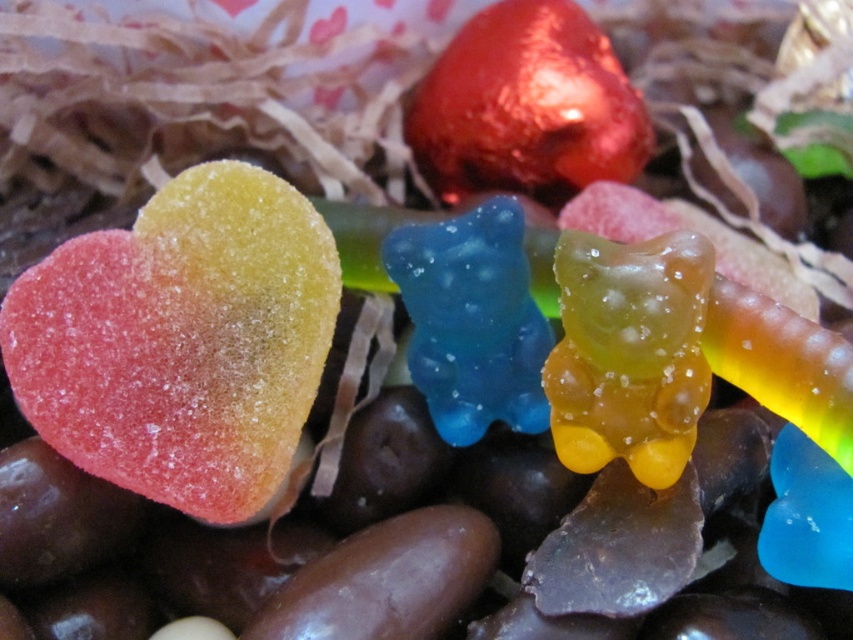
Question: Observing the image, what is the correct spatial positioning of rainbow-colored sugar-coated heart at left in reference to translucent blue gummy bear at center?

Choices:
 (A) below
 (B) above

Answer: (A)

Question: Does rainbow-colored sugar-coated heart at left have a larger size compared to translucent yellowish-gold bear at center?

Choices:
 (A) no
 (B) yes

Answer: (B)

Question: Among these objects, which one is farthest from the camera?

Choices:
 (A) translucent yellowish-gold bear at center
 (B) shiny metallic heart at upper center
 (C) translucent blue gummy bear at center

Answer: (B)

Question: Estimate the real-world distances between objects in this image. Which object is farther from the rainbow-colored sugar-coated heart at left?

Choices:
 (A) shiny metallic heart at upper center
 (B) translucent yellowish-gold bear at center

Answer: (A)

Question: Which object is closer to the camera taking this photo?

Choices:
 (A) translucent blue gummy bear at center
 (B) translucent yellowish-gold bear at center
 (C) rainbow-colored sugar-coated heart at left
 (D) shiny metallic heart at upper center

Answer: (B)

Question: Does shiny metallic heart at upper center have a greater width compared to translucent blue gummy bear at center?

Choices:
 (A) no
 (B) yes

Answer: (B)